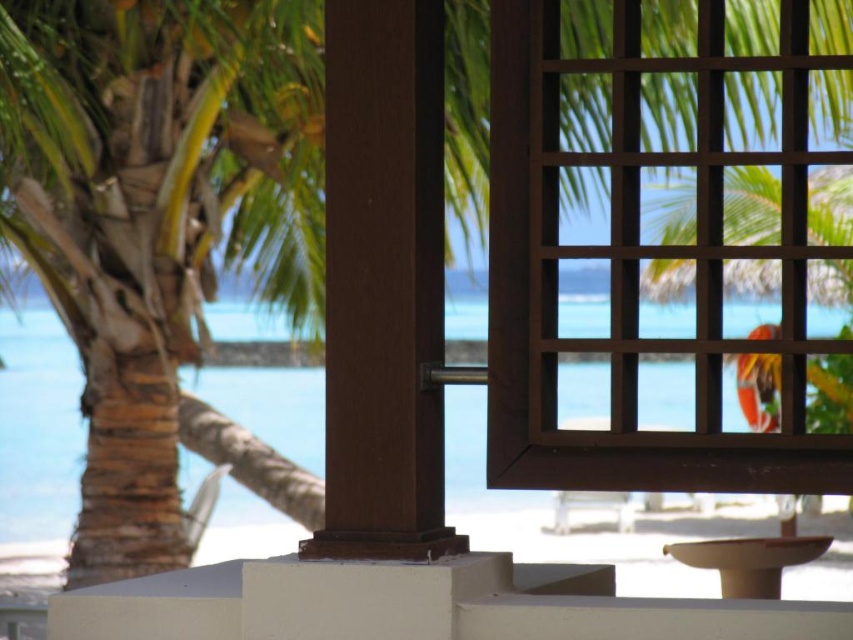
Question: Is brown wood pillar at center to the right of clear blue water at center from the viewer's perspective?

Choices:
 (A) no
 (B) yes

Answer: (A)

Question: Which object is positioned farthest from the clear blue water at center?

Choices:
 (A) brown wood pillar at center
 (B) brown wooden window at upper right
 (C) matte white stool at lower center

Answer: (B)

Question: Is brown wooden window at upper right smaller than brown wood pillar at center?

Choices:
 (A) yes
 (B) no

Answer: (B)

Question: Which point is farther to the camera?

Choices:
 (A) clear blue water at center
 (B) matte white stool at lower center

Answer: (B)

Question: Can you confirm if brown wooden window at upper right is positioned above brown wood pillar at center?

Choices:
 (A) no
 (B) yes

Answer: (B)

Question: Which object is positioned closest to the clear blue water at center?

Choices:
 (A) brown wood pillar at center
 (B) brown wooden window at upper right

Answer: (A)